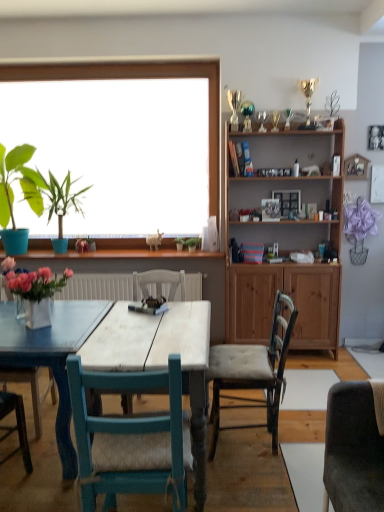
Question: Which direction should I rotate to face tufted fabric chair at center, which is the 1th chair in right-to-left order, — up or down?

Choices:
 (A) up
 (B) down

Answer: (B)

Question: Which direction should I rotate to look at green leafy plant at center, arranged as the 2th plant when viewed from the right, — up or down?

Choices:
 (A) up
 (B) down

Answer: (A)

Question: Is teal wood chair at center, which is the 1th chair in left-to-right order, behind wooden picture frame at upper center?

Choices:
 (A) yes
 (B) no

Answer: (B)

Question: Can you confirm if teal wood chair at center, positioned as the second chair in back-to-front order, is wider than wooden picture frame at upper center?

Choices:
 (A) no
 (B) yes

Answer: (B)

Question: Is teal wood chair at center, which is the 1th chair in left-to-right order, positioned with its back to wooden picture frame at upper center?

Choices:
 (A) no
 (B) yes

Answer: (A)

Question: Is teal wood chair at center, positioned as the second chair in back-to-front order, outside wooden picture frame at upper center?

Choices:
 (A) no
 (B) yes

Answer: (B)

Question: Considering the relative sizes of teal wood chair at center, positioned as the second chair in back-to-front order, and wooden picture frame at upper center in the image provided, is teal wood chair at center, positioned as the second chair in back-to-front order, smaller than wooden picture frame at upper center?

Choices:
 (A) yes
 (B) no

Answer: (B)

Question: Is teal wood chair at center, which is the 1th chair in left-to-right order, not close to wooden picture frame at upper center?

Choices:
 (A) yes
 (B) no

Answer: (A)

Question: Is white wood table at center inside green matte plant at center, placed as the 3th plant when sorted from left to right?

Choices:
 (A) no
 (B) yes

Answer: (A)

Question: Is green matte plant at center, positioned as the first plant in right-to-left order, shorter than white wood table at center?

Choices:
 (A) yes
 (B) no

Answer: (A)

Question: Considering the relative sizes of green matte plant at center, placed as the 3th plant when sorted from left to right, and white wood table at center in the image provided, is green matte plant at center, placed as the 3th plant when sorted from left to right, thinner than white wood table at center?

Choices:
 (A) no
 (B) yes

Answer: (B)

Question: From the image's perspective, does green matte plant at center, positioned as the first plant in right-to-left order, appear higher than white wood table at center?

Choices:
 (A) yes
 (B) no

Answer: (A)

Question: From a real-world perspective, is green matte plant at center, placed as the 3th plant when sorted from left to right, physically above white wood table at center?

Choices:
 (A) no
 (B) yes

Answer: (B)

Question: From the image's perspective, is green matte plant at center, positioned as the first plant in right-to-left order, under white wood table at center?

Choices:
 (A) no
 (B) yes

Answer: (A)

Question: From the image's perspective, does wooden cabinet at upper right appear lower than pink matte flower at window?

Choices:
 (A) yes
 (B) no

Answer: (B)